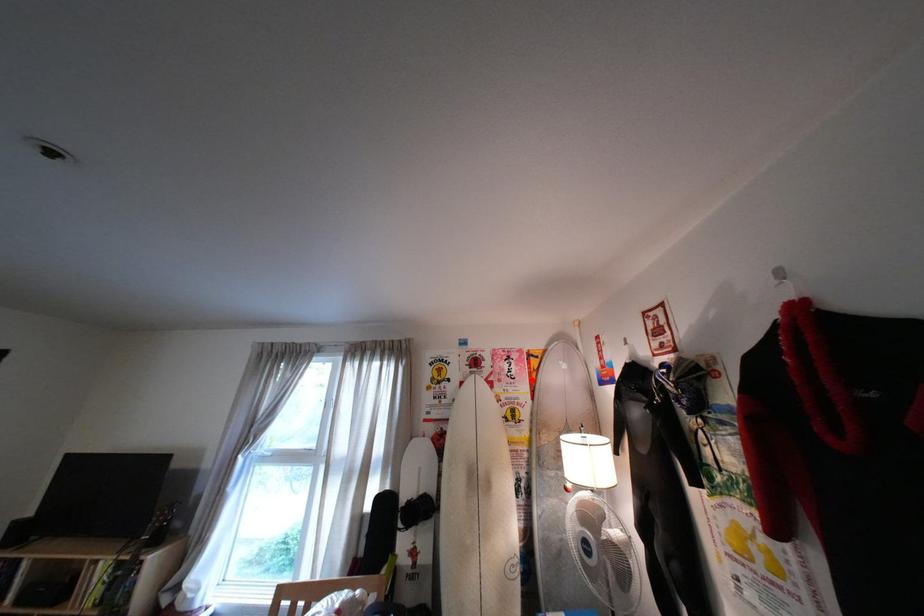
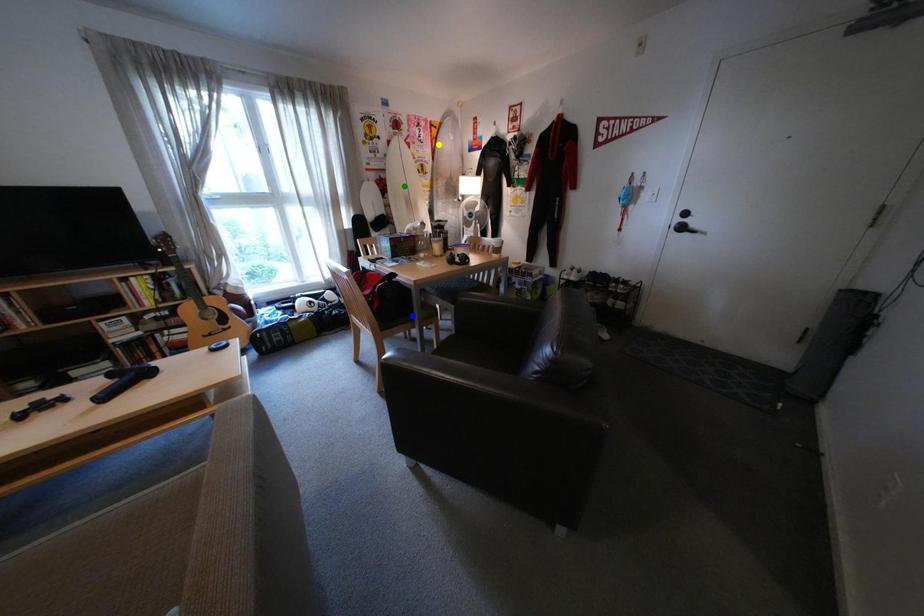
Question: I am providing you with two images of the same scene from different viewpoints. A red point is marked on the first image. You are given multiple points on the second image. Which point in image 2 represents the same 3d spot as the red point in image 1?

Choices:
 (A) yellow point
 (B) green point
 (C) blue point

Answer: (A)